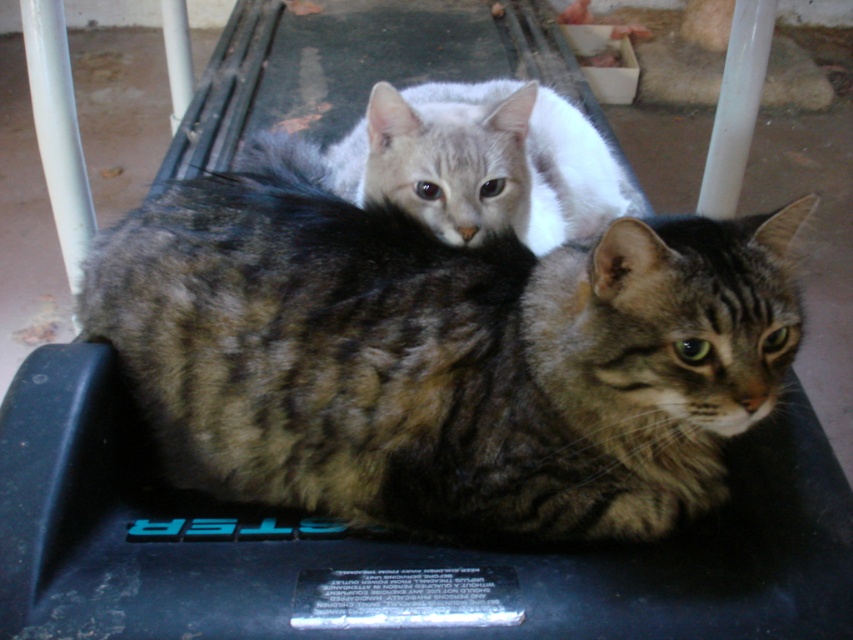
Question: Which point is farther from the camera taking this photo?

Choices:
 (A) (399, 230)
 (B) (437, 228)

Answer: (B)

Question: Is tabby fur cat at center thinner than gray fur cat at center?

Choices:
 (A) no
 (B) yes

Answer: (A)

Question: Is the position of tabby fur cat at center more distant than that of gray fur cat at center?

Choices:
 (A) no
 (B) yes

Answer: (A)

Question: Which point is closer to the camera?

Choices:
 (A) (236, 445)
 (B) (384, 136)

Answer: (A)

Question: Can you confirm if tabby fur cat at center is bigger than gray fur cat at center?

Choices:
 (A) yes
 (B) no

Answer: (A)